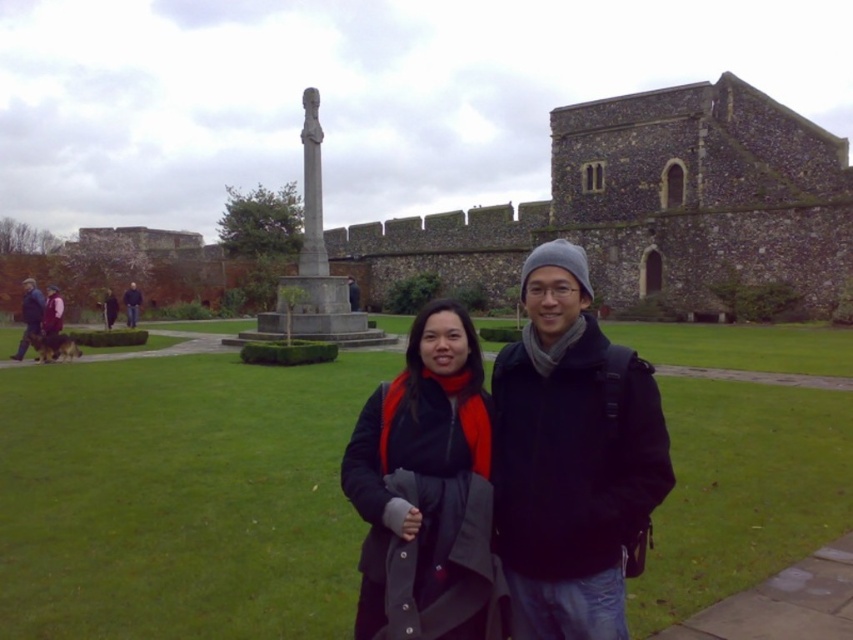
Is point (177, 593) in front of point (312, 228)?

Yes, it is.

Between green grass at center and gray stone statue at center, which one appears on the right side from the viewer's perspective?

Positioned to the right is green grass at center.

This screenshot has width=853, height=640. I want to click on green grass at center, so click(x=178, y=499).

Does gray stone statue at center lie in front of dark brown leather jacket at lower left?

Yes, gray stone statue at center is in front of dark brown leather jacket at lower left.

Is point (318, 291) behind point (132, 296)?

No, (318, 291) is in front of (132, 296).

This screenshot has height=640, width=853. I want to click on gray stone statue at center, so click(x=312, y=269).

What do you see at coordinates (28, 316) in the screenshot? The height and width of the screenshot is (640, 853). I see `dark blue jacket at left` at bounding box center [28, 316].

Looking at this image, who is more distant from viewer, (26, 326) or (141, 298)?

Point (141, 298)

The height and width of the screenshot is (640, 853). I want to click on dark blue jacket at left, so coord(28,316).